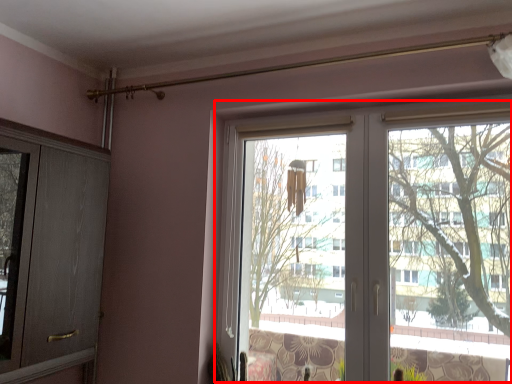
Question: Considering the relative positions of bay window (annotated by the red box) and screen door in the image provided, where is bay window (annotated by the red box) located with respect to the staircase?

Choices:
 (A) right
 (B) left

Answer: (A)